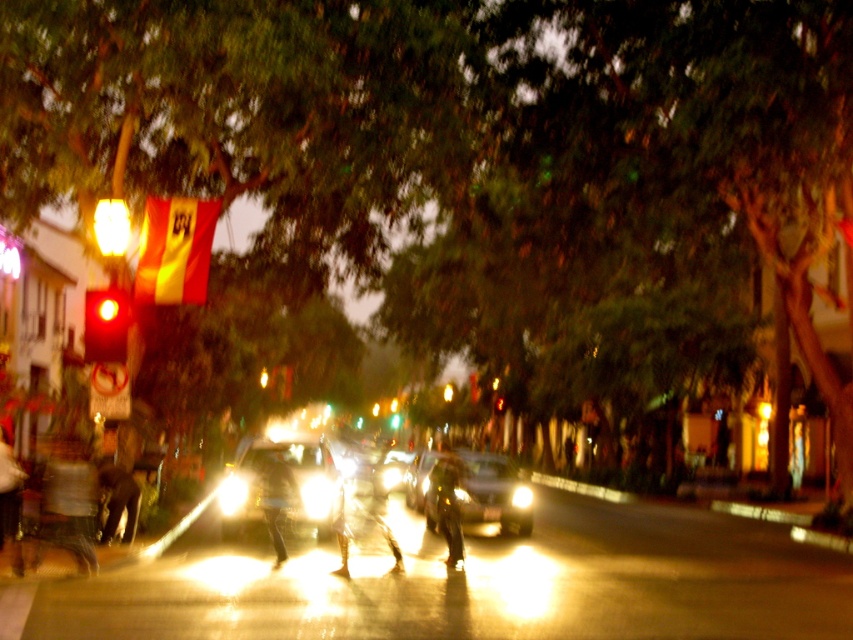
Question: Among these objects, which one is farthest from the camera?

Choices:
 (A) metallic silver pants at center
 (B) shiny silver car at center
 (C) red glass traffic light at left
 (D) green glass traffic light at center

Answer: (D)

Question: Can you confirm if red glass traffic light at left is positioned to the right of metallic gold person at center?

Choices:
 (A) yes
 (B) no

Answer: (B)

Question: Estimate the real-world distances between objects in this image. Which object is closer to the shiny silver car at center?

Choices:
 (A) shiny silver sedan at center
 (B) red glass traffic light at left

Answer: (A)

Question: Does red glass traffic light at left have a lesser width compared to metallic silver pants at center?

Choices:
 (A) no
 (B) yes

Answer: (A)

Question: Among these points, which one is farthest from the camera?

Choices:
 (A) 506,486
 (B) 367,458

Answer: (B)

Question: Is red glass traffic light at left thinner than metallic silver pants at center?

Choices:
 (A) no
 (B) yes

Answer: (A)